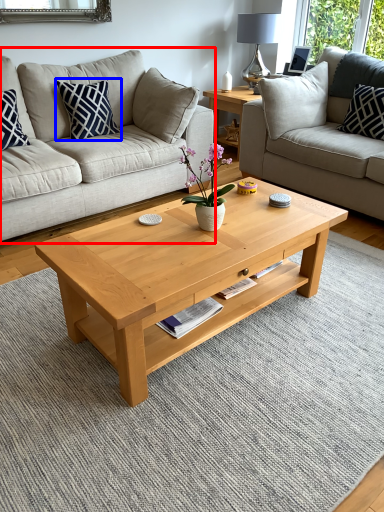
Question: Which object is closer to the camera taking this photo, studio couch (highlighted by a red box) or pillow (highlighted by a blue box)?

Choices:
 (A) studio couch
 (B) pillow

Answer: (A)